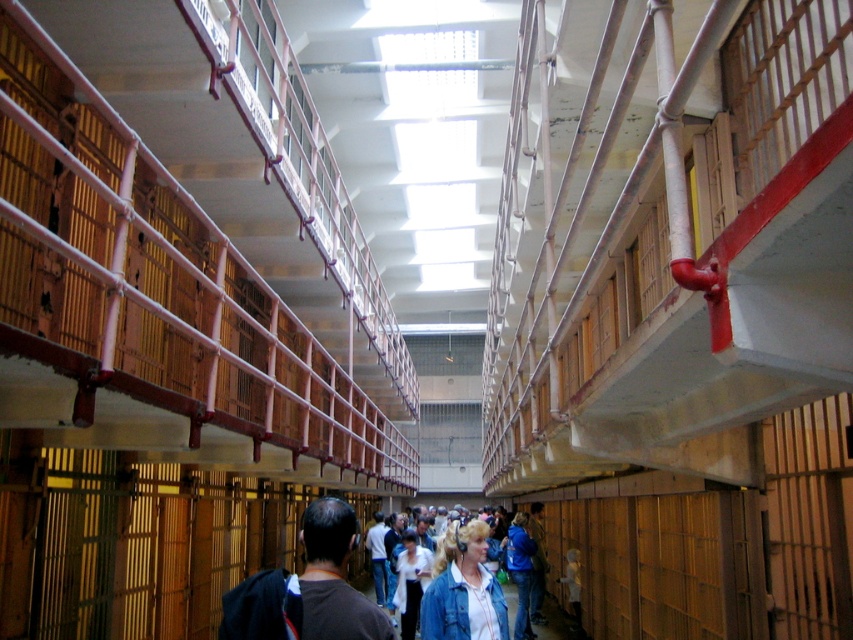
Based on the photo, you are a security guard in a prison. You see a point at coordinates (463, 589). What object is located at that point?

The point at coordinates (463, 589) is located on the denim jacket at center.

You are an inmate in the prison cell block and you see two denim jackets. One is the denim jacket at center and the other is the denim jacket at lower center. Which one is located to the right of the other?

The denim jacket at center is positioned on the right side of denim jacket at lower center.

In the scene shown: You are a delivery robot with a 1.2 meter wide package. You need to navigate through the prison cell block and pass by the point at coordinates (462, 593). The camera is positioned 4.90 meters away from this point. Can you safely pass through the area without hitting the walls or railings?

The distance between the camera and the point at coordinates (462, 593) is 4.90 meters. Since the walkway is wide, the delivery robot with a 1.2 meter wide package can safely pass through the area without hitting the walls or railings.